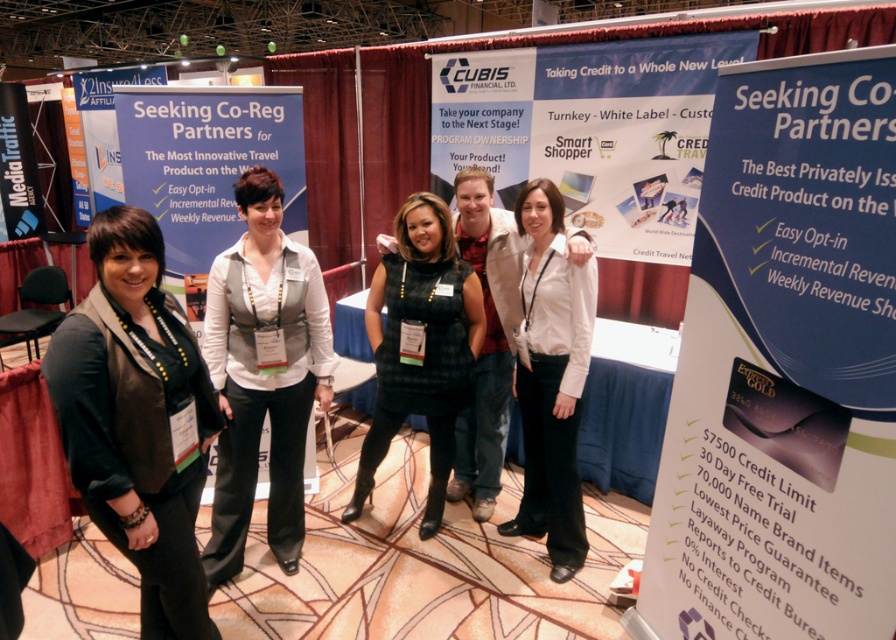
Is point (108, 508) behind point (274, 397)?

That is False.

Where is `matte brown vest at left`? The width and height of the screenshot is (896, 640). matte brown vest at left is located at coordinates (136, 419).

Is point (177, 520) farther from camera compared to point (421, 340)?

No.

Is point (144, 433) positioned in front of point (406, 339)?

Yes, point (144, 433) is in front of point (406, 339).

This screenshot has height=640, width=896. Find the location of `matte brown vest at left`. matte brown vest at left is located at coordinates (136, 419).

Is black plaid dress at center positioned behind white matte shirt at center?

Yes, it is.

Does black plaid dress at center have a lesser width compared to white matte shirt at center?

In fact, black plaid dress at center might be wider than white matte shirt at center.

Does point (462, 321) come closer to viewer compared to point (535, 429)?

That is True.

Where is `black plaid dress at center`? The image size is (896, 640). black plaid dress at center is located at coordinates tap(420, 346).